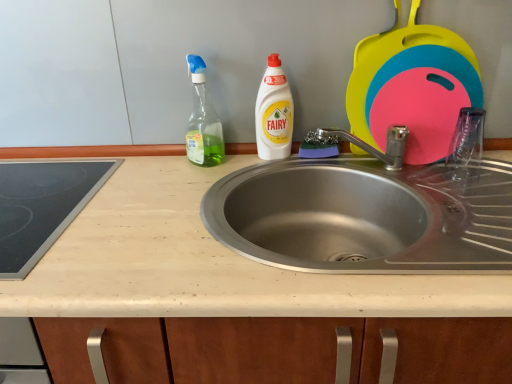
Find the location of a particular element. Image resolution: width=512 pixels, height=384 pixels. vacant region above beige laminate countertop at center (from a real-world perspective) is located at coordinates (204, 212).